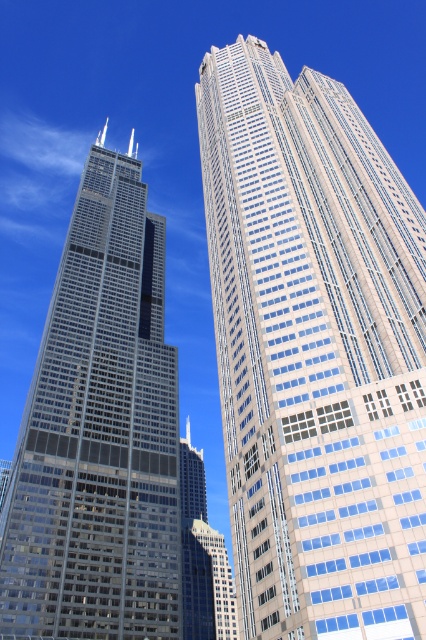
Question: Which of the following is the closest to the observer?

Choices:
 (A) (333, 381)
 (B) (94, 604)

Answer: (A)

Question: Does glassy steel skyscraper at center have a greater width compared to glassy steel skyscraper at left?

Choices:
 (A) yes
 (B) no

Answer: (A)

Question: Is glassy steel skyscraper at center smaller than glassy steel skyscraper at left?

Choices:
 (A) yes
 (B) no

Answer: (B)

Question: Among these objects, which one is nearest to the camera?

Choices:
 (A) glassy steel skyscraper at center
 (B) glassy steel skyscraper at left

Answer: (A)

Question: Does glassy steel skyscraper at center have a greater width compared to glassy steel skyscraper at left?

Choices:
 (A) yes
 (B) no

Answer: (A)